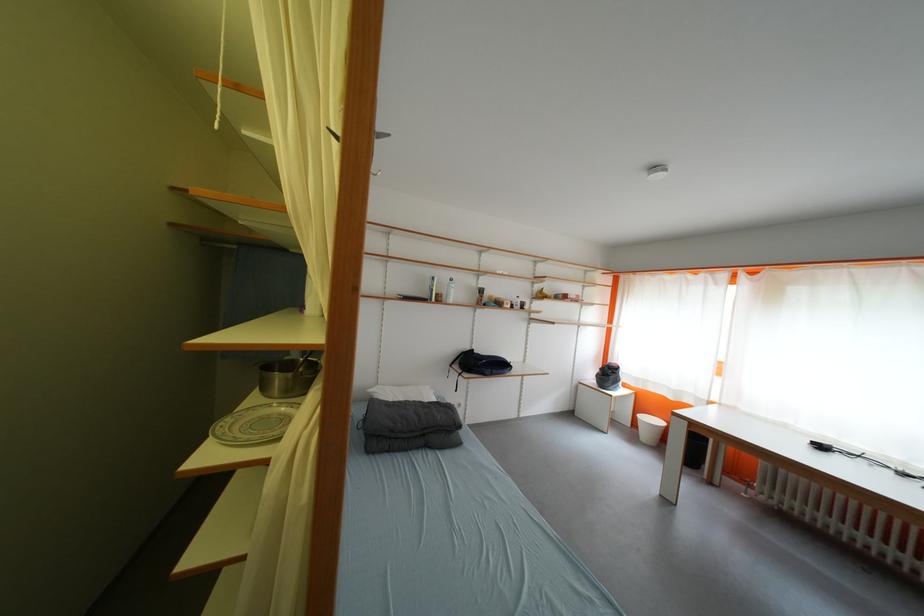
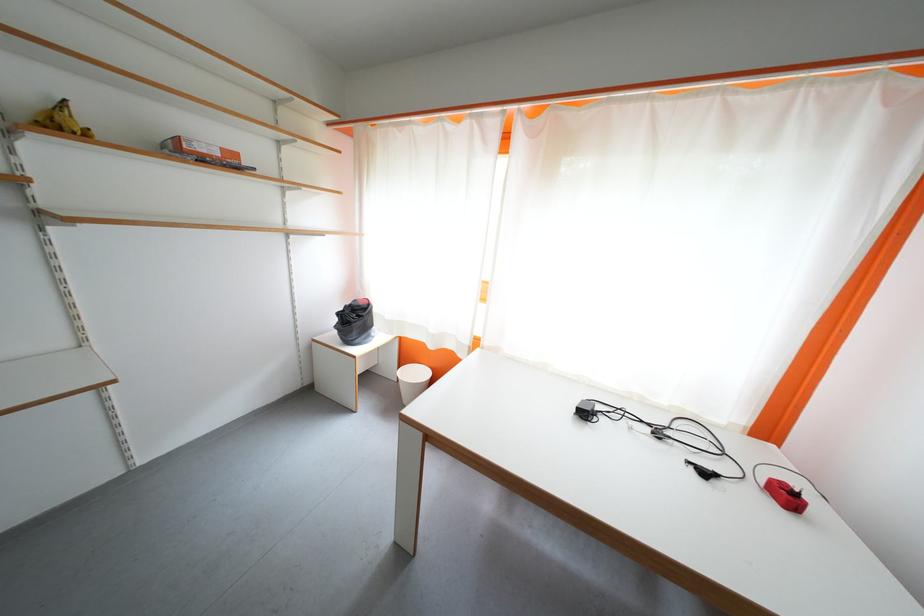
Locate, in the second image, the point that corresponds to (x=550, y=299) in the first image.

(68, 129)